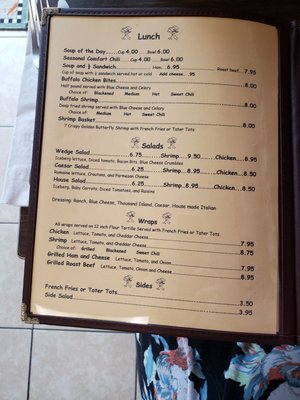
What are the coordinates of `corner` in the screenshot? It's located at [x=24, y=321], [x=26, y=28], [x=34, y=330].